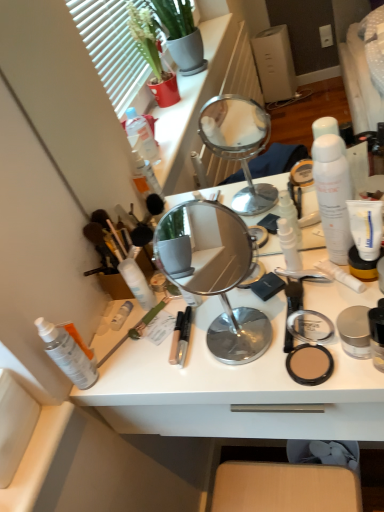
Where is `vacant area that lies between polished silver mirror at center and white matte spray can at left, which ranks as the 2th toiletry in left-to-right order`? This screenshot has width=384, height=512. vacant area that lies between polished silver mirror at center and white matte spray can at left, which ranks as the 2th toiletry in left-to-right order is located at coordinates (156, 354).